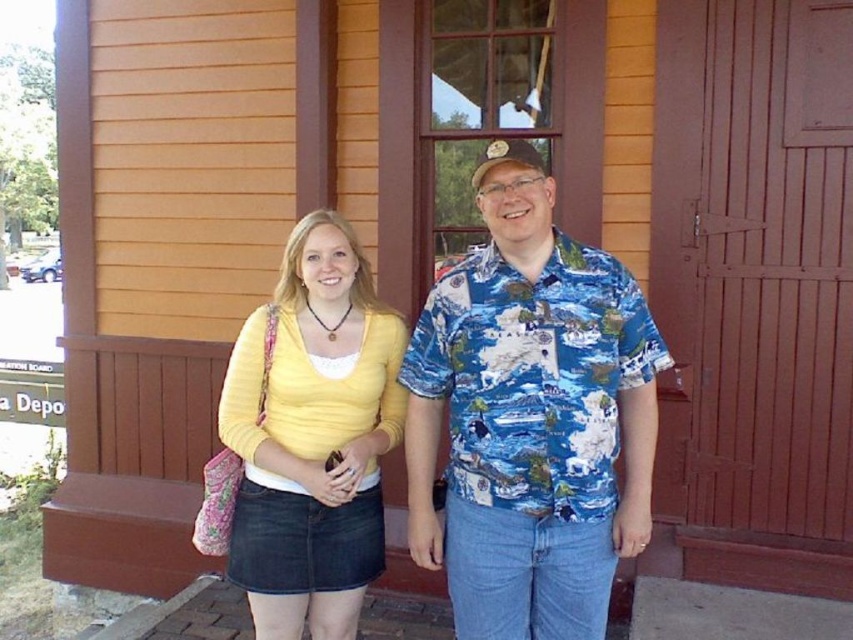
You are standing in front of the wooden building and see a point at coordinates [531,417]. According to the image, what object or clothing item is this point located on?

The point at coordinates [531,417] is located on the blue printed shirt at center.

You are a photographer standing in front of the wooden building. You notice two people wearing the blue printed shirt at center and the matte yellow sweater at center. Which person is positioned to the right of the other?

The blue printed shirt at center is to the right of the matte yellow sweater at center, so the person wearing the blue printed shirt at center is positioned to the right of the person in the matte yellow sweater at center.